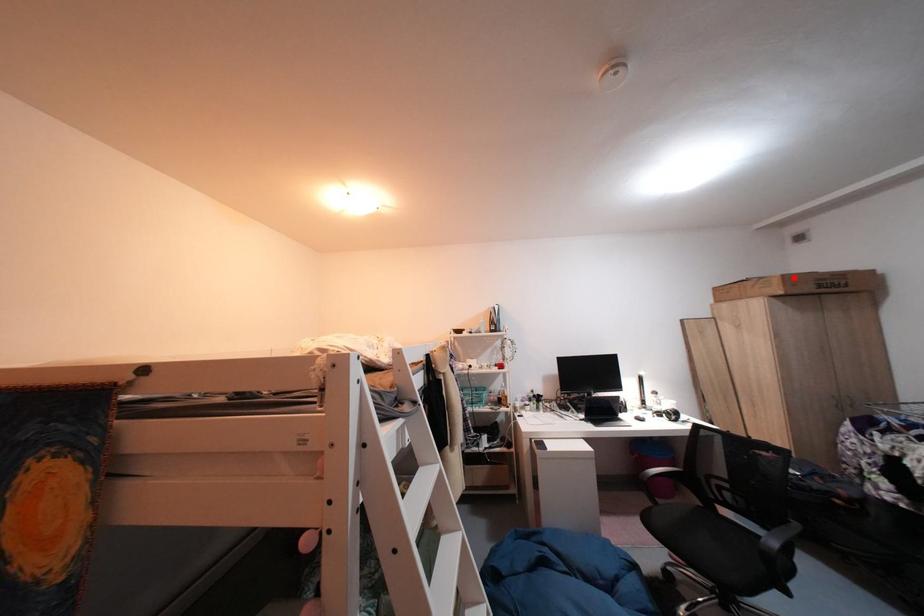
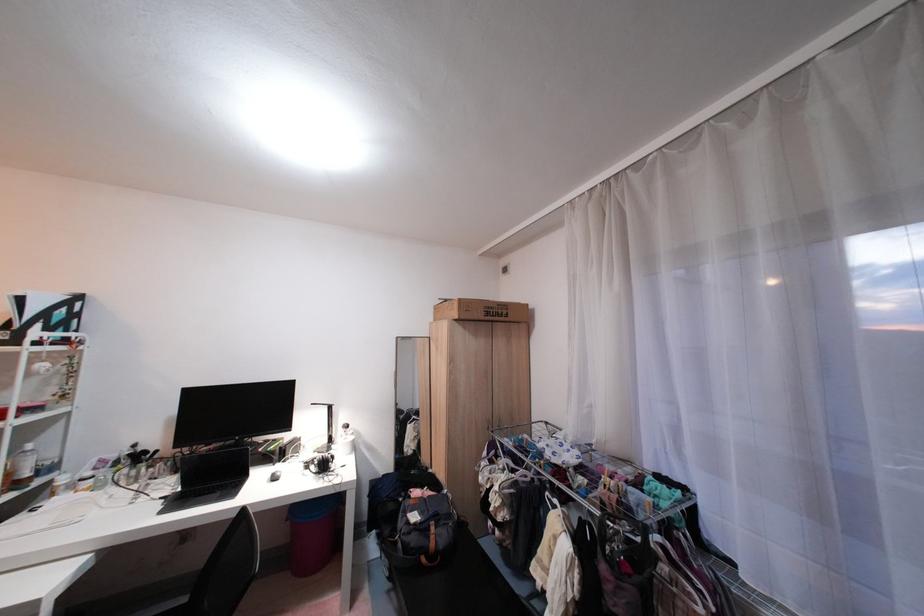
Find the pixel in the second image that matches the highlighted location in the first image.

(470, 302)